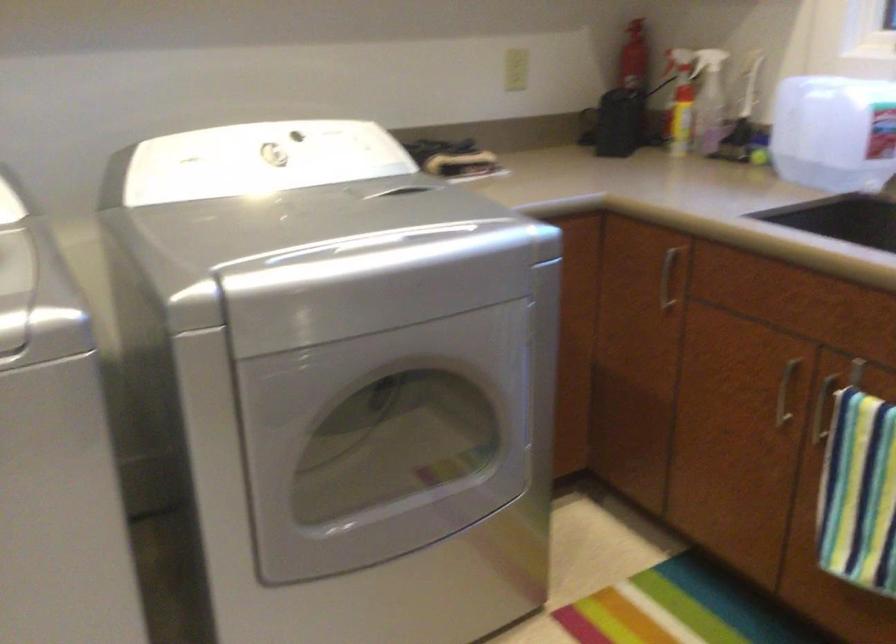
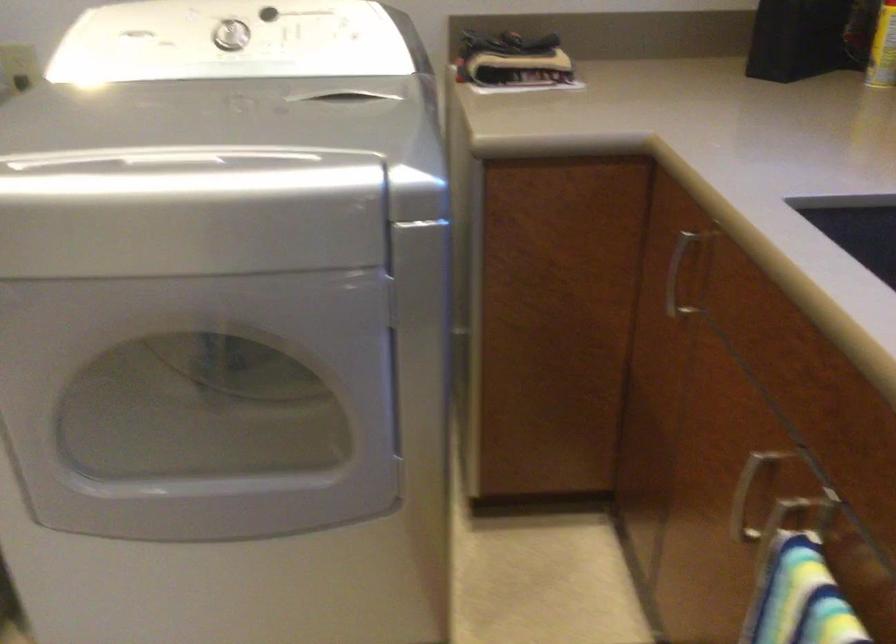
Find the pixel in the second image that matches (x=771, y=401) in the first image.

(745, 497)